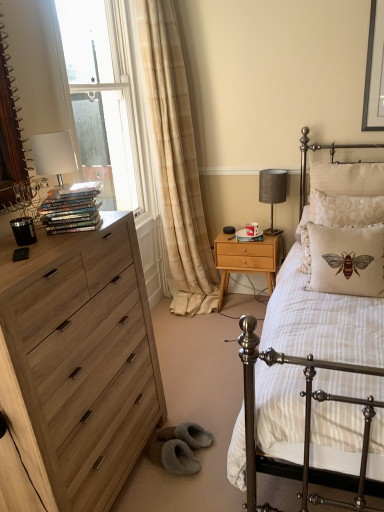
Question: From the image's perspective, is light wood/texture nightstand at center located above or below beige damask pillow at right, positioned as the second pillow in front-to-back order?

Choices:
 (A) above
 (B) below

Answer: (B)

Question: In the image, is light wood/texture nightstand at center on the left side or the right side of beige damask pillow at right, positioned as the second pillow in front-to-back order?

Choices:
 (A) right
 (B) left

Answer: (B)

Question: Based on their relative distances, which object is farther from the shiny metallic books at left?

Choices:
 (A) white striped fabric at center
 (B) beige damask pillow at right, positioned as the second pillow in front-to-back order
 (C) beige embroidered pillow at right, the 1th pillow in the front-to-back sequence
 (D) beige damask pillow with bee design at center, which ranks as the third pillow in front-to-back order
 (E) white glass window at upper left

Answer: (E)

Question: Estimate the real-world distances between objects in this image. Which object is closer to the white striped fabric at center?

Choices:
 (A) beige damask pillow with bee design at center, which ranks as the third pillow in front-to-back order
 (B) beige damask pillow at right, positioned as the second pillow in front-to-back order
 (C) beige embroidered pillow at right, which is counted as the 3th pillow, starting from the back
 (D) shiny metallic books at left
 (E) light wood chest of drawers at left

Answer: (C)